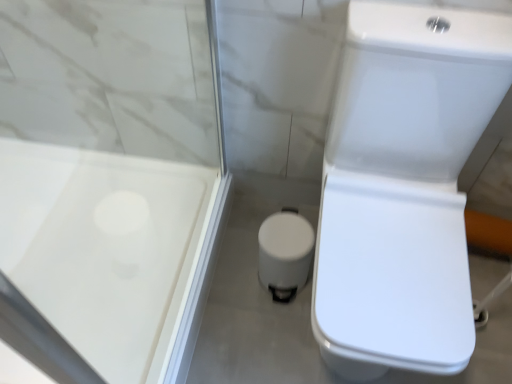
Question: Can you confirm if white glossy trash can at center is bigger than white glossy toilet at right?

Choices:
 (A) yes
 (B) no

Answer: (B)

Question: Considering the relative positions of white glossy trash can at center and white glossy toilet at right in the image provided, is white glossy trash can at center to the right of white glossy toilet at right from the viewer's perspective?

Choices:
 (A) no
 (B) yes

Answer: (A)

Question: Is white glossy trash can at center oriented away from white glossy toilet at right?

Choices:
 (A) yes
 (B) no

Answer: (B)

Question: From the image's perspective, would you say white glossy trash can at center is positioned over white glossy toilet at right?

Choices:
 (A) yes
 (B) no

Answer: (B)

Question: Considering the relative sizes of white glossy trash can at center and white glossy toilet at right in the image provided, is white glossy trash can at center wider than white glossy toilet at right?

Choices:
 (A) yes
 (B) no

Answer: (B)

Question: Can you confirm if white glossy trash can at center is smaller than white glossy toilet at right?

Choices:
 (A) no
 (B) yes

Answer: (B)

Question: From the image's perspective, is white glossy toilet at right beneath transparent plastic screen door at upper left?

Choices:
 (A) no
 (B) yes

Answer: (B)

Question: Does white glossy toilet at right have a greater height compared to transparent plastic screen door at upper left?

Choices:
 (A) no
 (B) yes

Answer: (A)

Question: Considering the relative positions of white glossy toilet at right and transparent plastic screen door at upper left in the image provided, is white glossy toilet at right to the right of transparent plastic screen door at upper left from the viewer's perspective?

Choices:
 (A) yes
 (B) no

Answer: (A)

Question: Are white glossy toilet at right and transparent plastic screen door at upper left far apart?

Choices:
 (A) yes
 (B) no

Answer: (B)

Question: Is white glossy toilet at right not within transparent plastic screen door at upper left?

Choices:
 (A) yes
 (B) no

Answer: (A)

Question: Considering the relative positions of white glossy toilet at right and transparent plastic screen door at upper left in the image provided, is white glossy toilet at right to the left of transparent plastic screen door at upper left from the viewer's perspective?

Choices:
 (A) yes
 (B) no

Answer: (B)

Question: From a real-world perspective, is transparent plastic screen door at upper left on top of white glossy trash can at center?

Choices:
 (A) no
 (B) yes

Answer: (B)